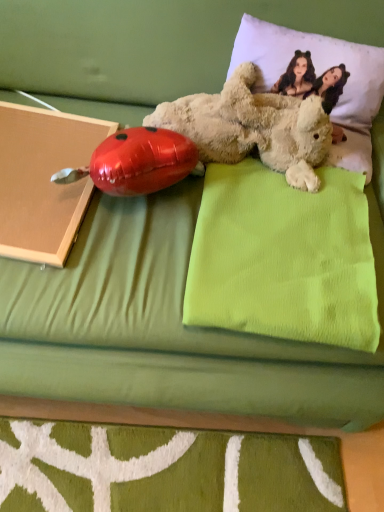
Locate an element on the screen. This screenshot has width=384, height=512. free location above white soft pillow at upper right, which is counted as the second pillow, starting from the bottom (from a real-world perspective) is located at coordinates (312, 38).